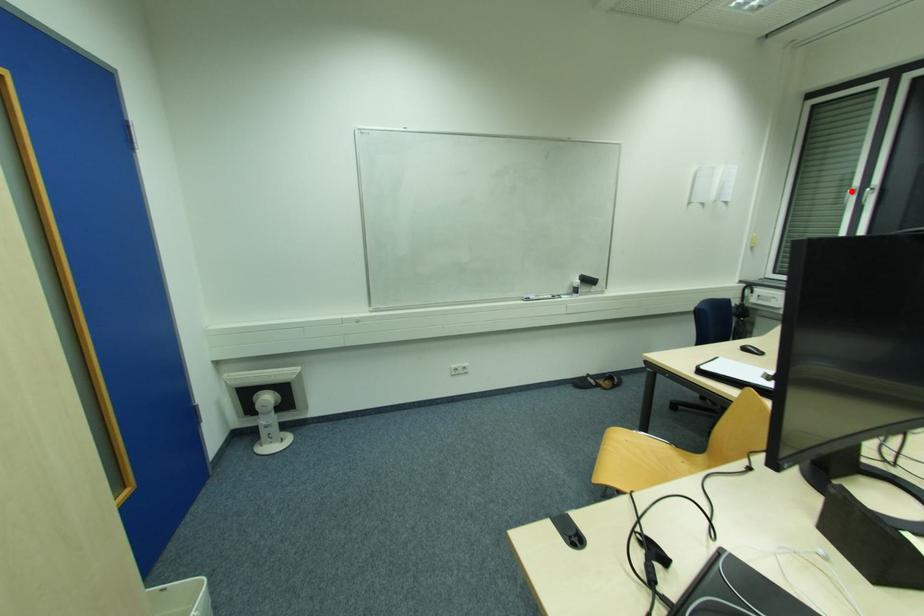
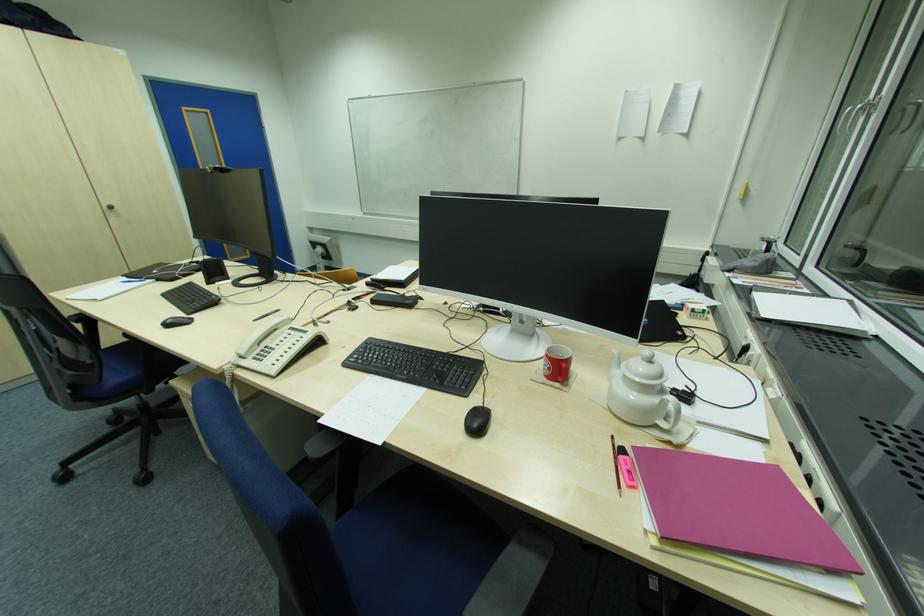
The point at the highlighted location is marked in the first image. Where is the corresponding point in the second image?

(850, 111)